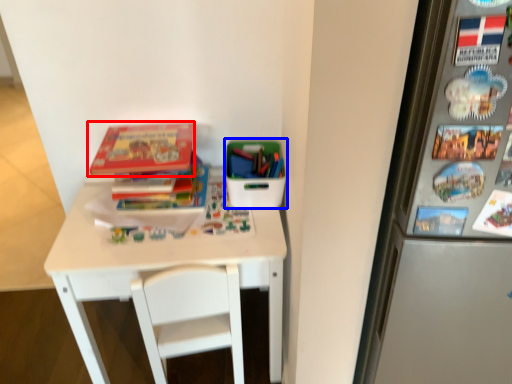
Question: Which point is further to the camera, book (highlighted by a red box) or box (highlighted by a blue box)?

Choices:
 (A) book
 (B) box

Answer: (B)